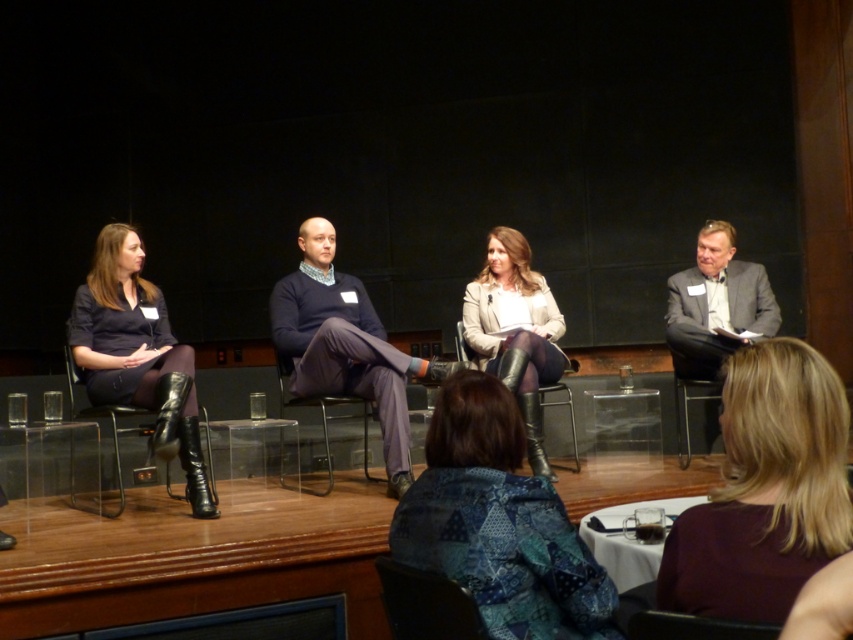
Can you confirm if matte blue sweater at center is thinner than metallic silver chair at center?

In fact, matte blue sweater at center might be wider than metallic silver chair at center.

Who is higher up, matte blue sweater at center or metallic silver chair at center?

matte blue sweater at center

Where is `matte blue sweater at center`? The height and width of the screenshot is (640, 853). matte blue sweater at center is located at coordinates point(344,346).

This screenshot has height=640, width=853. Find the location of `matte blue sweater at center`. matte blue sweater at center is located at coordinates (344, 346).

Where is `metallic silver chair at center`? Image resolution: width=853 pixels, height=640 pixels. metallic silver chair at center is located at coordinates (363, 385).

Between metallic silver chair at center and matte black chair at lower center, which one appears on the right side from the viewer's perspective?

From the viewer's perspective, matte black chair at lower center appears more on the right side.

Is point (368, 356) farther from viewer compared to point (453, 634)?

Yes.

At what (x,y) coordinates should I click in order to perform the action: click on metallic silver chair at center. Please return your answer as a coordinate pair (x, y). This screenshot has height=640, width=853. Looking at the image, I should click on tap(363, 385).

Is matte gray blazer at center positioned in front of gray suit jacket at right?

That is True.

Measure the distance between matte gray blazer at center and camera.

They are 4.01 meters apart.

At what (x,y) coordinates should I click in order to perform the action: click on matte gray blazer at center. Please return your answer as a coordinate pair (x, y). The width and height of the screenshot is (853, 640). Looking at the image, I should click on (515, 330).